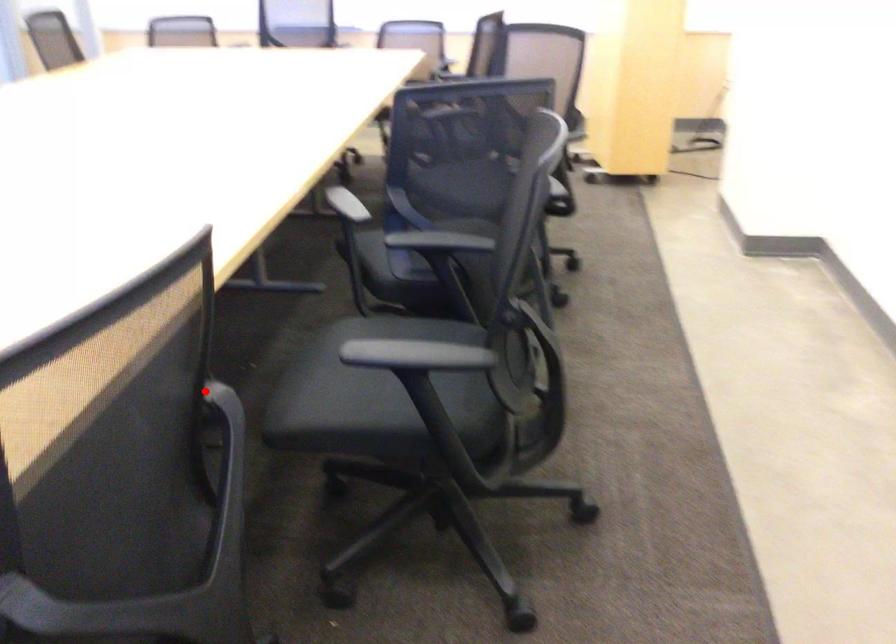
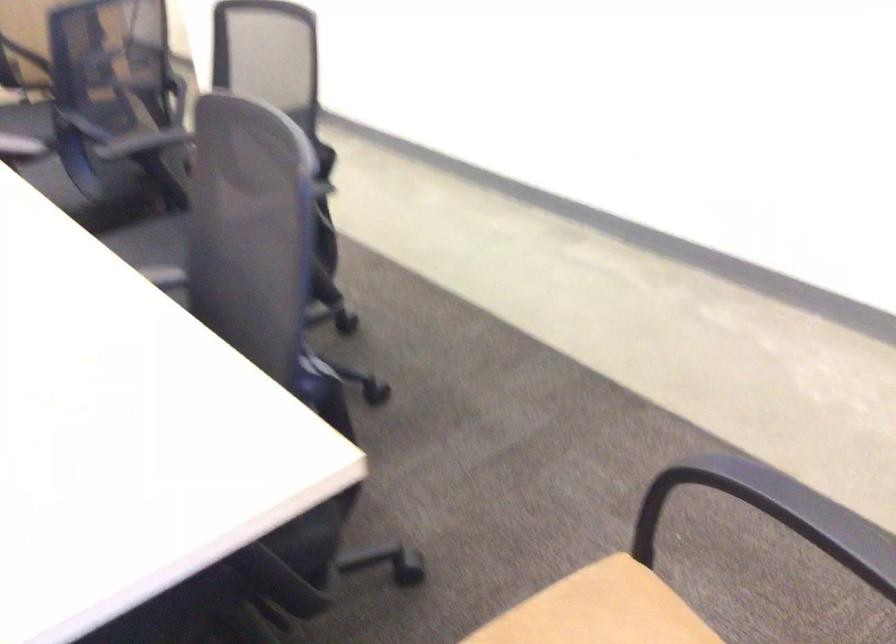
Question: I am providing you with two images of the same scene from different viewpoints. Image1 has a red point marked. In image2, the corresponding 3D location appears at what relative position? Reply with the corresponding letter.

Choices:
 (A) Closer
 (B) Farther

Answer: (B)